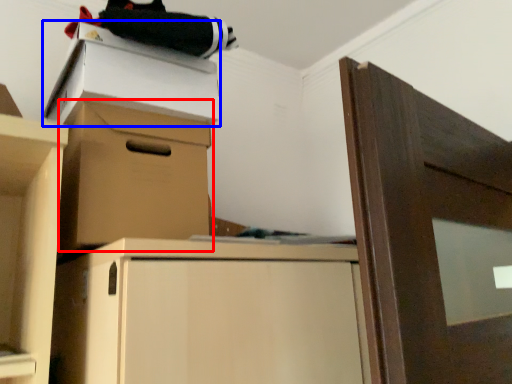
Question: Which object is closer to the camera taking this photo, cabinetry (highlighted by a red box) or cardboard box (highlighted by a blue box)?

Choices:
 (A) cabinetry
 (B) cardboard box

Answer: (A)